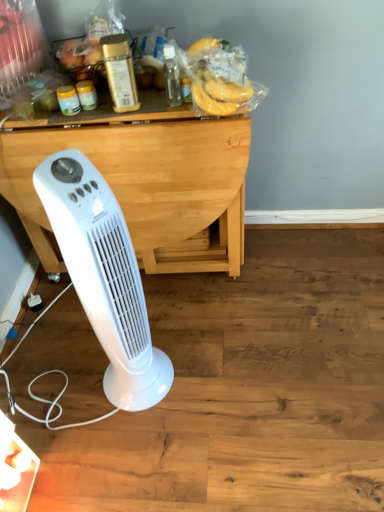
You are a GUI agent. You are given a task and a screenshot of the screen. Output one action in this format:
    pyautogui.click(x=<x>, y=<y>)
    Task: Click on the free space that is to the left of transparent plastic bottle at center, which ranks as the first bottle in right-to-left order
    
    Given the screenshot: What is the action you would take?
    pyautogui.click(x=137, y=105)